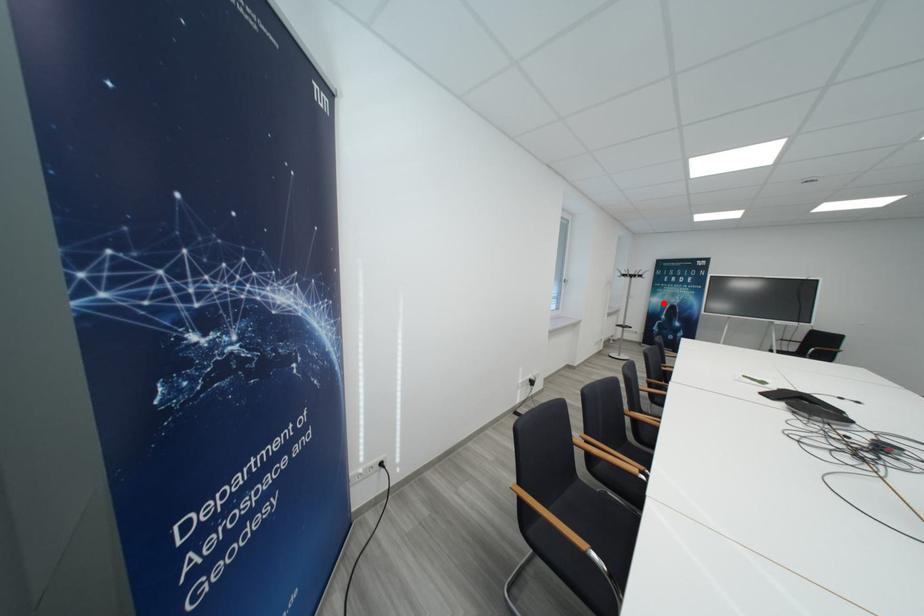
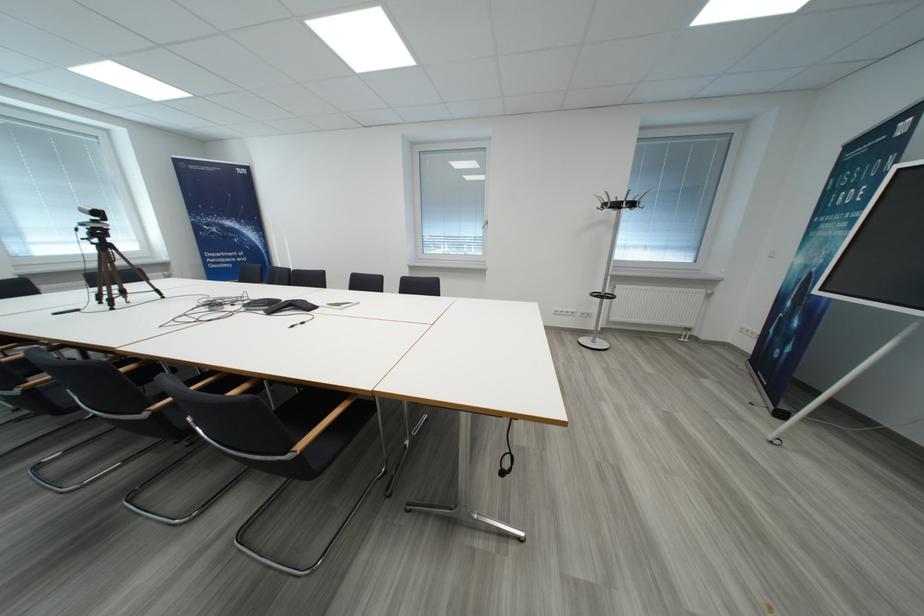
Question: I am providing you with two images of the same scene from different viewpoints. In image1, a red point is highlighted. Considering the same 3D point in image2, which of the following is correct?

Choices:
 (A) It is closer
 (B) It is farther

Answer: (B)